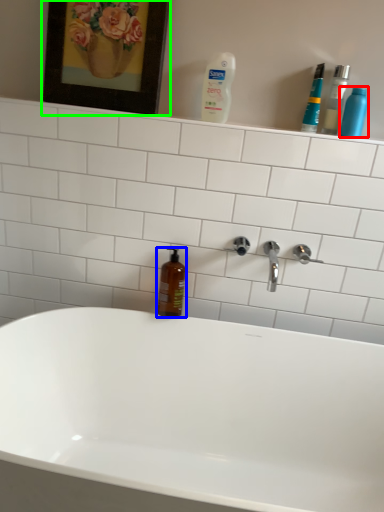
Question: Which object is the closest to the cleaning product (highlighted by a red box)? Choose among these: mouthwash (highlighted by a blue box) or picture frame (highlighted by a green box).

Choices:
 (A) mouthwash
 (B) picture frame

Answer: (B)